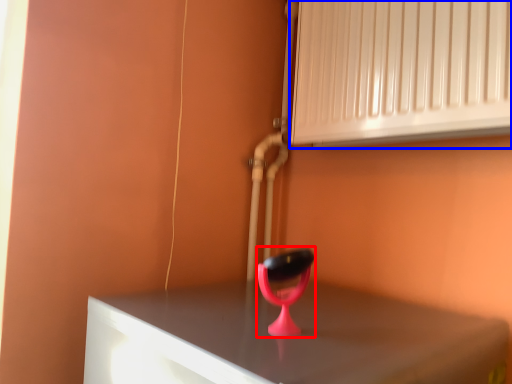
Question: Which of the following is the closest to the observer, table lamp (highlighted by a red box) or air conditioning (highlighted by a blue box)?

Choices:
 (A) table lamp
 (B) air conditioning

Answer: (A)